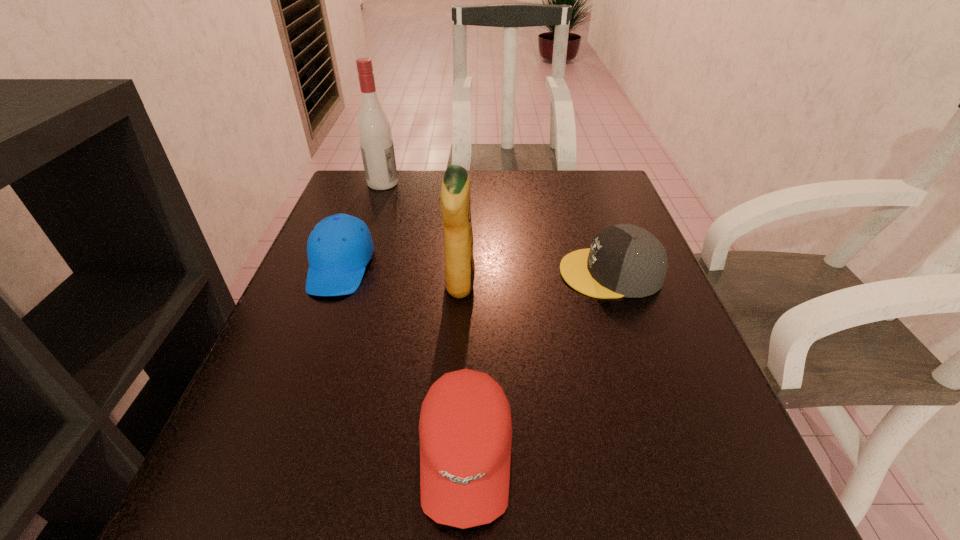
Find the location of a particular element. unoccupied position between the rightmost object and the farthest object is located at coordinates (496, 228).

At what (x,y) coordinates should I click in order to perform the action: click on free point between the second tallest object and the alcohol. Please return your answer as a coordinate pair (x, y). The height and width of the screenshot is (540, 960). Looking at the image, I should click on (421, 234).

Where is `unoccupied position between the tallest object and the rightmost object`? The width and height of the screenshot is (960, 540). unoccupied position between the tallest object and the rightmost object is located at coordinates (496, 228).

Point out which object is positioned as the third nearest to the nearest cap. Please provide its 2D coordinates. Your answer should be formatted as a tuple, i.e. [(x, y)], where the tuple contains the x and y coordinates of a point satisfying the conditions above.

[(339, 247)]

Choose which object is the nearest neighbor to the second cap from left to right. Please provide its 2D coordinates. Your answer should be formatted as a tuple, i.e. [(x, y)], where the tuple contains the x and y coordinates of a point satisfying the conditions above.

[(455, 206)]

I want to click on cap that is the closest to the nearest object, so click(x=624, y=260).

I want to click on the third closest cap to the farthest object, so click(465, 428).

The width and height of the screenshot is (960, 540). What are the coordinates of `free location that satisfies the following two spatial constraints: 1. on the label of the alcohol; 2. on the front-facing side of the leftmost cap` in the screenshot? It's located at (355, 266).